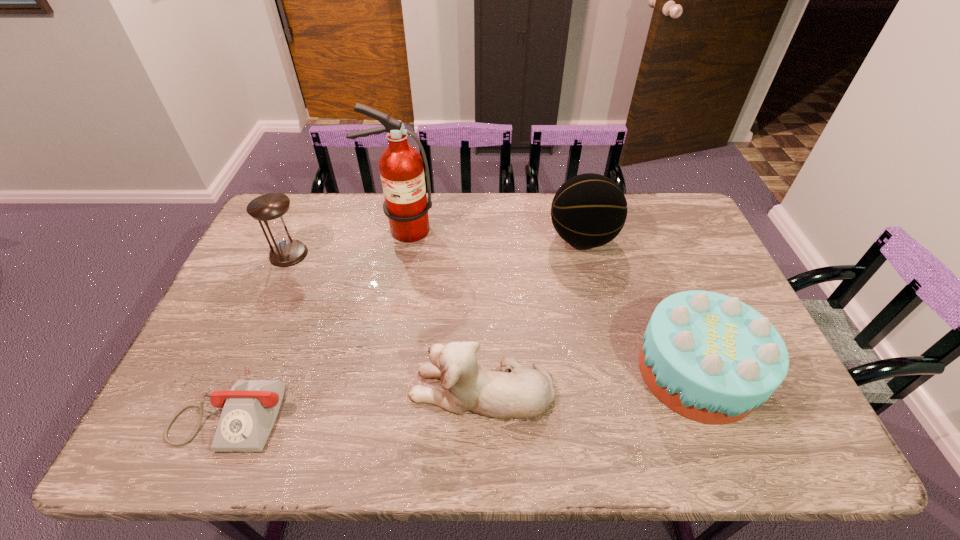
Image resolution: width=960 pixels, height=540 pixels. I want to click on vacant space that's between the fire extinguisher and the hourglass, so click(x=345, y=242).

Image resolution: width=960 pixels, height=540 pixels. Find the location of `free space that is in between the hourglass and the shortest object`. free space that is in between the hourglass and the shortest object is located at coordinates (260, 331).

Identify the location of empty location between the shortest object and the hourglass. (260, 331).

The height and width of the screenshot is (540, 960). Find the location of `free space between the puppy and the second tallest object`. free space between the puppy and the second tallest object is located at coordinates (532, 314).

Identify the location of vacant area between the telephone and the tallest object. 317,319.

Identify which object is located as the third nearest to the shortest object. Please provide its 2D coordinates. Your answer should be formatted as a tuple, i.e. [(x, y)], where the tuple contains the x and y coordinates of a point satisfying the conditions above.

[(401, 168)]

Locate which object is the second closest to the shortest object. Please provide its 2D coordinates. Your answer should be formatted as a tuple, i.e. [(x, y)], where the tuple contains the x and y coordinates of a point satisfying the conditions above.

[(270, 209)]

Identify the location of free space that satisfies the following two spatial constraints: 1. on the back side of the hourglass; 2. on the left side of the second tallest object. Image resolution: width=960 pixels, height=540 pixels. (296, 239).

What are the coordinates of `vacant space that satisfies the following two spatial constraints: 1. on the front-facing side of the puppy; 2. on the dial of the telephone` in the screenshot? It's located at (482, 408).

The width and height of the screenshot is (960, 540). Identify the location of vacant space that satisfies the following two spatial constraints: 1. on the nozzle and handle of the fire extinguisher; 2. on the left side of the cake. [374, 372].